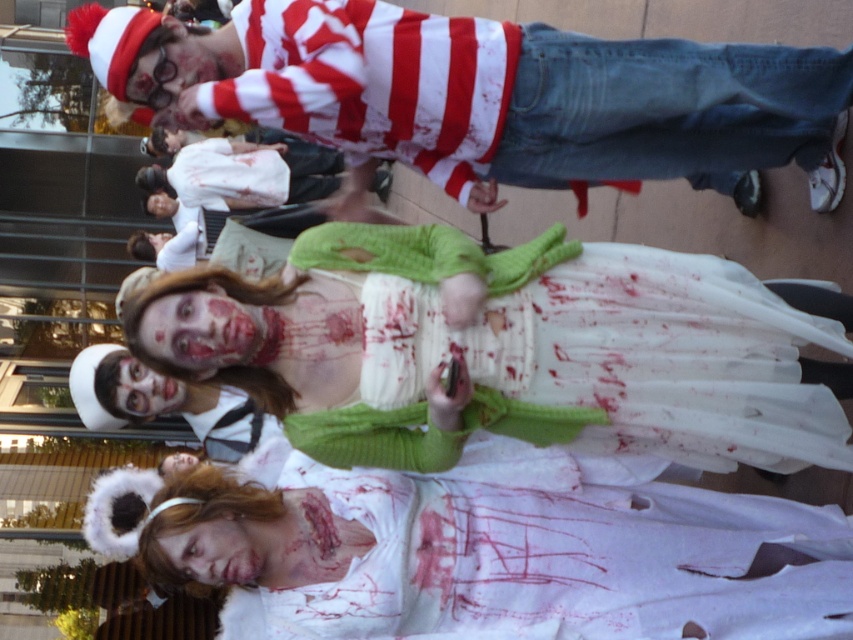
You are a photographer trying to capture the entire scene in a single shot. Considering the white sheer dress at center and the matte white face at center, which object would appear larger in the photo?

The white sheer dress at center would appear larger in the photo because it has a greater height compared to the matte white face at center.

You are a photographer at the event and want to capture the white sheer dress at center and the matte white face at center in a single photo. Which object should you focus on first to ensure both are in frame?

The white sheer dress at center is located above the matte white face at center, so focus on the white sheer dress at center first to ensure both are captured in the photo.